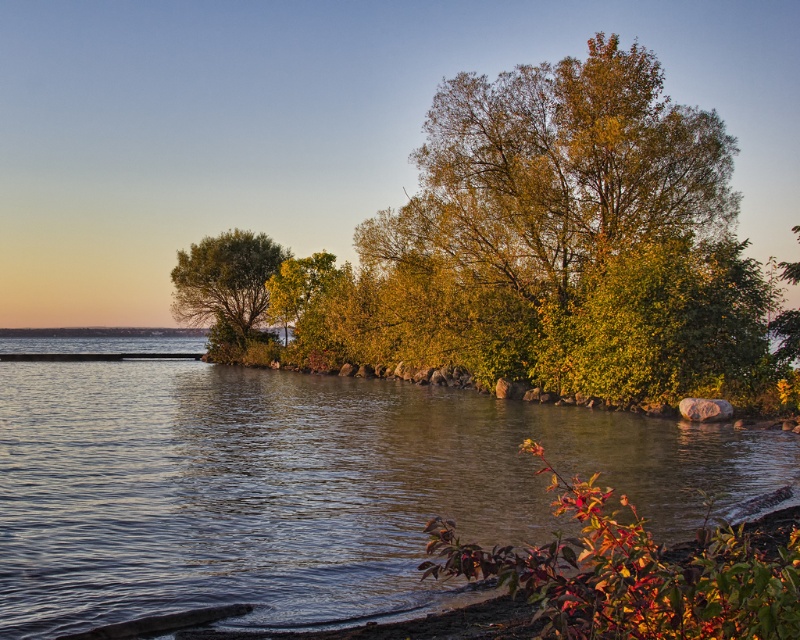
Question: Among these objects, which one is farthest from the camera?

Choices:
 (A) green matte tree at center-left
 (B) green leafy tree at center
 (C) clear water at center

Answer: (A)

Question: Is green leafy tree at center below green matte tree at center-left?

Choices:
 (A) no
 (B) yes

Answer: (A)

Question: Which object appears farthest from the camera in this image?

Choices:
 (A) green matte tree at center-left
 (B) green leafy tree at center

Answer: (A)

Question: Among these points, which one is farthest from the camera?

Choices:
 (A) (22, 500)
 (B) (620, 72)
 (C) (240, 296)

Answer: (C)

Question: Is clear water at center smaller than green matte tree at center-left?

Choices:
 (A) yes
 (B) no

Answer: (B)

Question: Is clear water at center bigger than green matte tree at center-left?

Choices:
 (A) yes
 (B) no

Answer: (A)